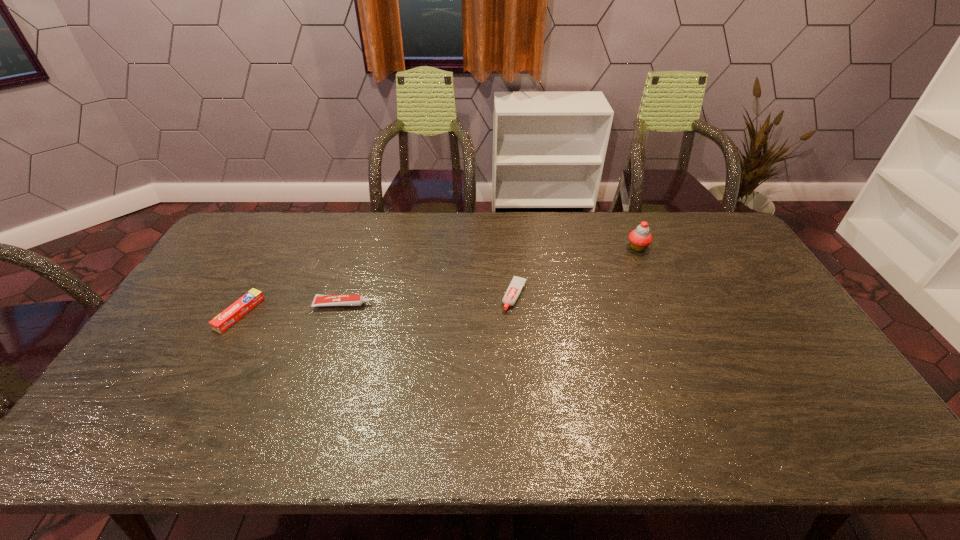
Where is `the tallest object`? the tallest object is located at coordinates (640, 238).

Find the location of a particular element. cupcake is located at coordinates (640, 238).

Identify the location of the third object from right to left. (320, 300).

Identify the location of the third object from left to right. (517, 283).

In order to click on the leftmost toothpaste in this screenshot , I will do point(239,308).

Locate an element on the screen. This screenshot has height=540, width=960. free space located 0.230m on the right of the tallest object is located at coordinates (715, 247).

Locate an element on the screen. This screenshot has height=540, width=960. free space located at the nozzle of the second toothpaste from right to left is located at coordinates (428, 305).

Where is `vacant space situated 0.360m on the right of the second object from right to left`? vacant space situated 0.360m on the right of the second object from right to left is located at coordinates (646, 295).

Identify the location of blank space located 0.260m on the front of the leftmost toothpaste. (182, 417).

Locate an element on the screen. object situated at the far edge is located at coordinates (640, 238).